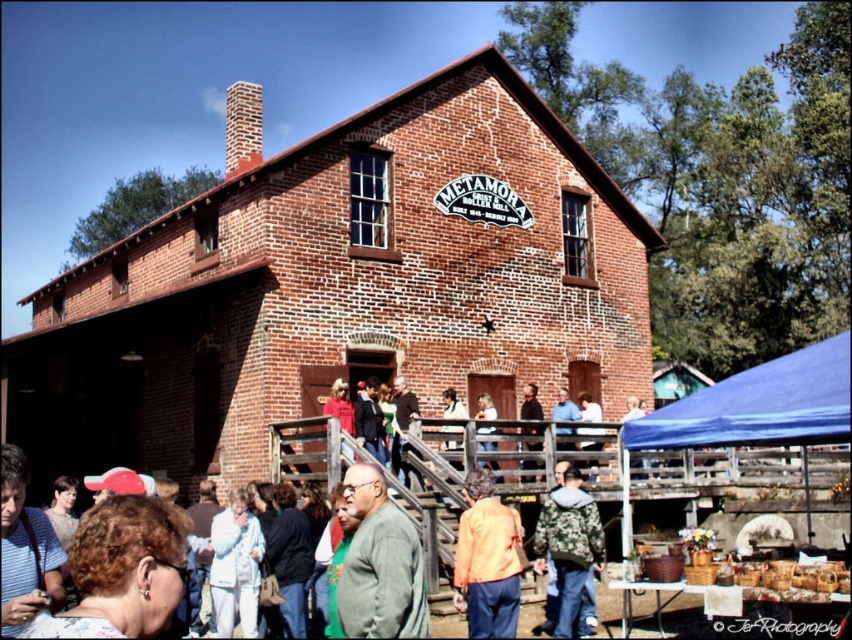
Can you confirm if green fuzzy sweater at center is shorter than camouflage jacket at lower center?

In fact, green fuzzy sweater at center may be taller than camouflage jacket at lower center.

Is green fuzzy sweater at center taller than camouflage jacket at lower center?

Yes.

Who is more forward, (x=421, y=625) or (x=602, y=548)?

Point (x=421, y=625) is more forward.

Locate an element on the screen. This screenshot has width=852, height=640. green fuzzy sweater at center is located at coordinates (380, 563).

From the picture: Who is taller, orange fabric jacket at center or camouflage jacket at lower center?

Standing taller between the two is orange fabric jacket at center.

Between point (492, 636) and point (563, 513), which one is positioned in front?

Point (492, 636) is in front.

Locate an element on the screen. The height and width of the screenshot is (640, 852). orange fabric jacket at center is located at coordinates (487, 561).

Does green fuzzy sweater at center appear on the right side of orange fabric jacket at center?

No, green fuzzy sweater at center is not to the right of orange fabric jacket at center.

Does point (361, 522) come in front of point (464, 609)?

Yes, it is.

Identify the location of green fuzzy sweater at center. (380, 563).